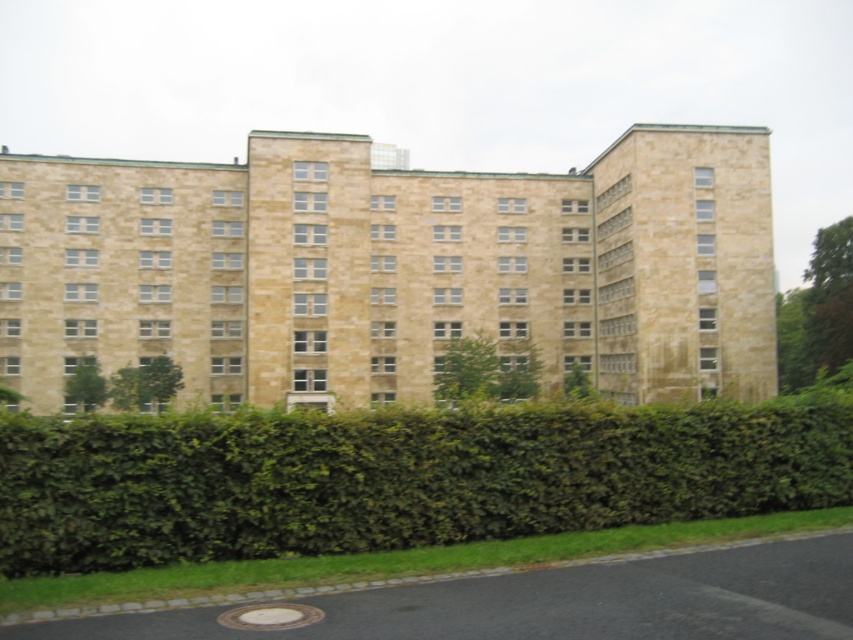
You are standing in front of the building and want to walk to the green leafy hedge at lower center. What coordinates should you aim for?

You should aim for point (x=396, y=477) to reach the green leafy hedge at lower center.

You are a gardener who needs to water the green leafy hedge at lower center and the green leafy bush at center. Which one is closer to the ground?

The green leafy hedge at lower center is closer to the ground because it is located below the green leafy bush at center.